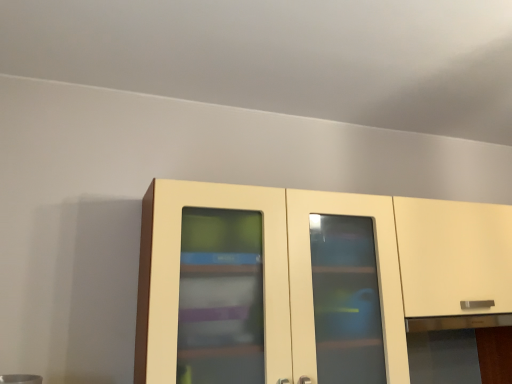
Question: Should I look upward or downward to see matte cream cupboard at center?

Choices:
 (A) up
 (B) down

Answer: (B)